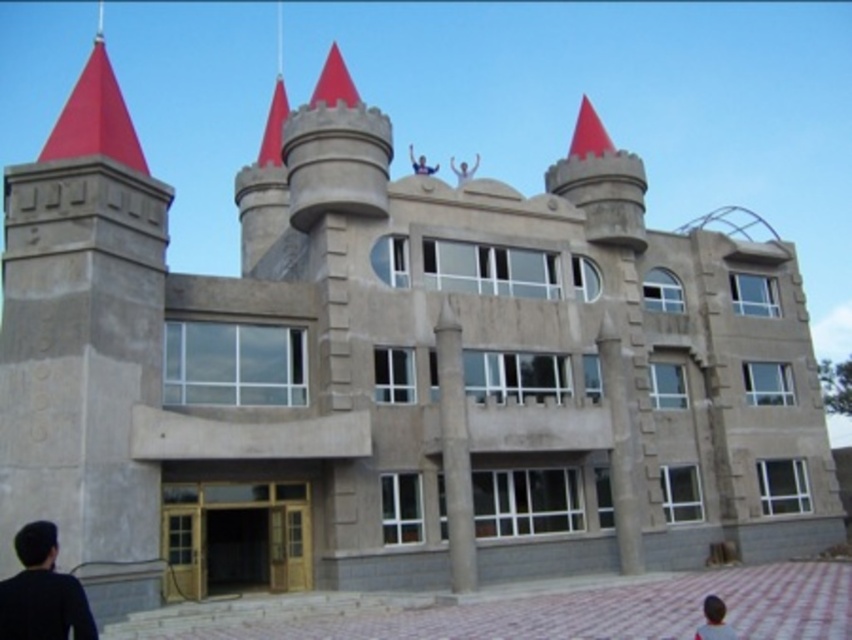
Between white matte head at lower right and smooth skin person at upper center, which one has more height?

smooth skin person at upper center

At what (x,y) coordinates should I click in order to perform the action: click on white matte head at lower right. Please return your answer as a coordinate pair (x, y). The image size is (852, 640). Looking at the image, I should click on (714, 620).

Can you confirm if white matte head at lower right is bigger than white matte person at upper center?

No, white matte head at lower right is not bigger than white matte person at upper center.

Can you confirm if white matte head at lower right is thinner than white matte person at upper center?

Yes, white matte head at lower right is thinner than white matte person at upper center.

Is point (698, 637) positioned after point (458, 168)?

That is False.

You are a GUI agent. You are given a task and a screenshot of the screen. Output one action in this format:
    pyautogui.click(x=<x>, y=<y>)
    Task: Click on the white matte head at lower right
    This screenshot has height=640, width=852.
    Given the screenshot: What is the action you would take?
    pyautogui.click(x=714, y=620)

Who is shorter, black matte shirt at lower left or smooth skin person at upper center?

Standing shorter between the two is black matte shirt at lower left.

Can you confirm if black matte shirt at lower left is positioned to the left of smooth skin person at upper center?

Correct, you'll find black matte shirt at lower left to the left of smooth skin person at upper center.

The width and height of the screenshot is (852, 640). What are the coordinates of `black matte shirt at lower left` in the screenshot? It's located at tap(42, 592).